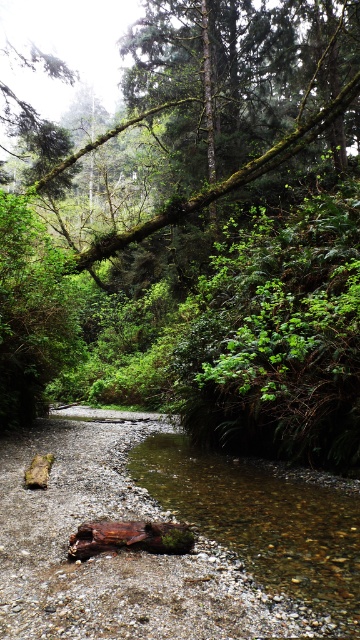
You are standing in the forest scene and want to take a photo. There are two points marked in the image, point 1 at coordinates point [333,81] and point 2 at coordinates point [172,504]. Which point is closer to your camera?

Point [333,81] is further to the camera than point [172,504], so point [172,504] is closer to the camera.

You are a hiker trying to cross the stream. You see the green mossy branch at upper center and the clear water at stream center. Which object is closer to you as you stand on the bank?

The green mossy branch at upper center is closer to you because the clear water at stream center is behind it.

You are a hiker navigating through the forest and want to reach a specific point. You see the green mossy branch at upper center. Can you determine its exact location using coordinates?

The green mossy branch at upper center is located at point (201, 120).